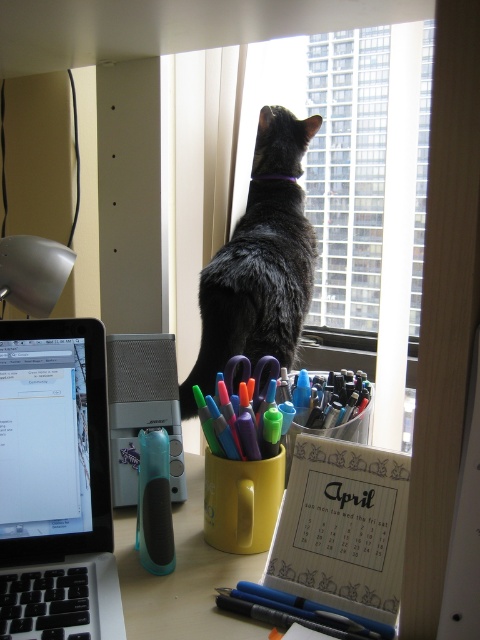
You are organizing your desk and need to place both the silver metallic laptop at left and the matte black pen at lower center into a drawer. The drawer has a width of 20 cm. Can both items fit side by side horizontally?

The silver metallic laptop at left is larger in size than the matte black pen at lower center. Since the laptop is bigger, it might not fit alongside the pen in a 20 cm drawer. Check their combined width.

You are organizing your desk and want to place a notebook between the matte plastic cup at center and the teal rubberized eraser at center. The notebook is 5 inches wide. Will it fit between them?

The distance between the matte plastic cup at center and the teal rubberized eraser at center is 4.81 inches. Since the notebook is 5 inches wide, it will not fit between them as the space is slightly narrower than the notebook.

You are organizing your desk and need to place both the matte plastic cup at center and the teal rubberized eraser at center into a drawer. The drawer has a height restriction of 10 cm. Can both items fit vertically if the cup is 12 cm tall and the eraser is 3 cm tall?

The matte plastic cup at center is 12 cm tall, which exceeds the drawer height of 10 cm. The teal rubberized eraser at center is 3 cm tall and can fit. Therefore, only the teal rubberized eraser at center will fit vertically in the drawer.